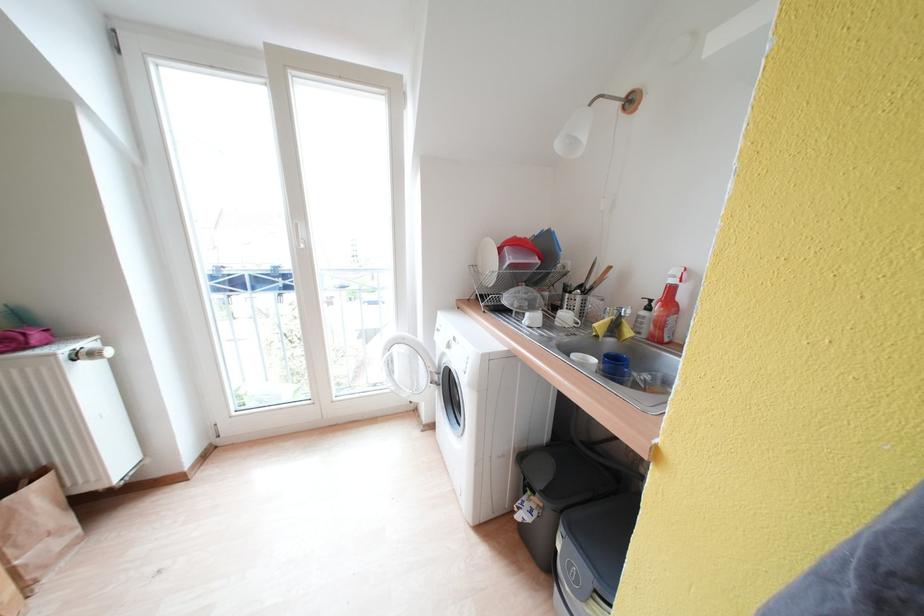
Image resolution: width=924 pixels, height=616 pixels. In order to click on white mug handle in this screenshot , I will do `click(565, 320)`.